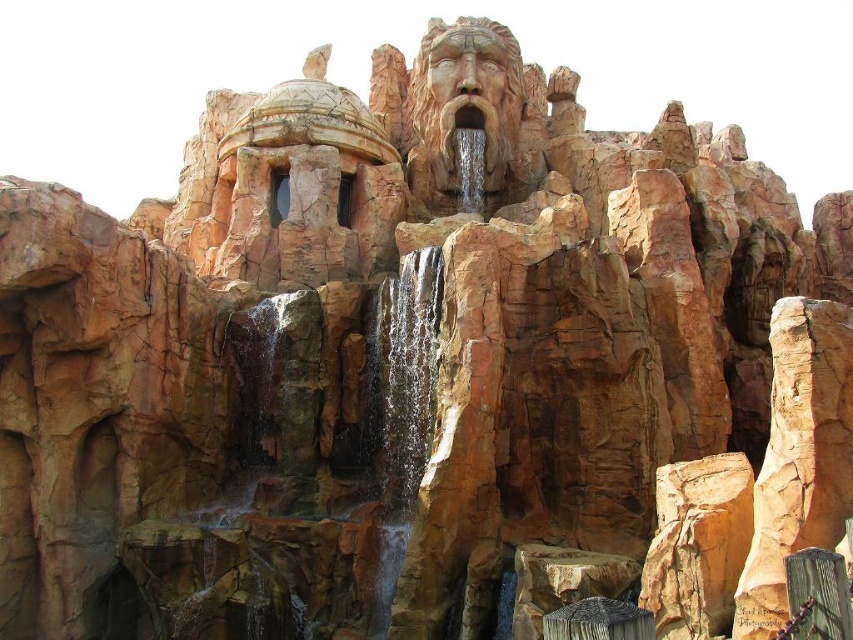
Which is more to the left, clear water at center or brown textured waterfall at center?

clear water at center

Can you confirm if clear water at center is positioned below brown textured waterfall at center?

Correct, clear water at center is located below brown textured waterfall at center.

Is point (440, 284) closer to camera compared to point (454, 128)?

That is True.

Where is `clear water at center`? clear water at center is located at coordinates (405, 376).